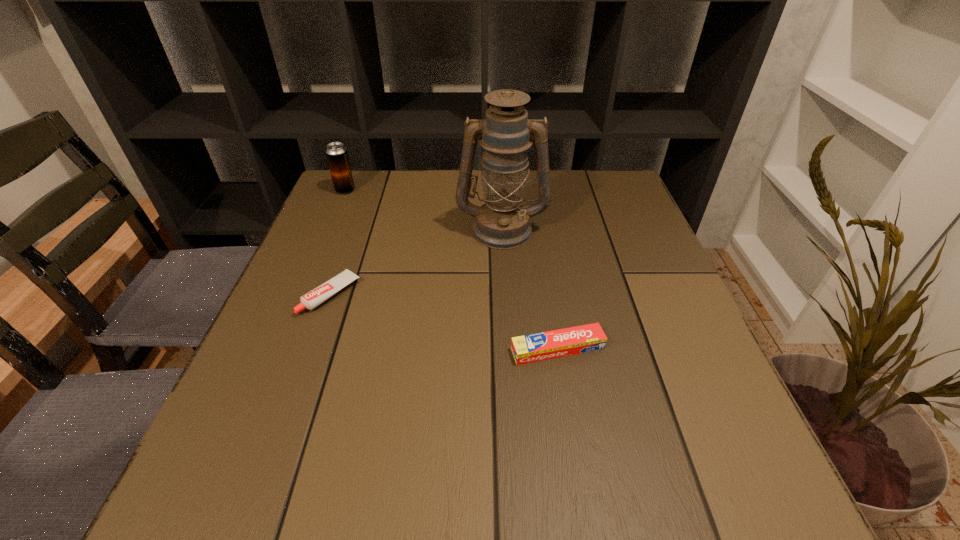
Identify the location of vacant space that is in between the left toothpaste and the oil lamp. The image size is (960, 540). click(x=417, y=262).

Where is `vacant area between the beer can and the tallest object`? vacant area between the beer can and the tallest object is located at coordinates (423, 210).

The image size is (960, 540). What are the coordinates of `free space between the second nearest object and the second tallest object` in the screenshot? It's located at (338, 242).

Choose which object is the third nearest neighbor to the farther toothpaste. Please provide its 2D coordinates. Your answer should be formatted as a tuple, i.e. [(x, y)], where the tuple contains the x and y coordinates of a point satisfying the conditions above.

[(337, 156)]

At what (x,y) coordinates should I click in order to perform the action: click on object that is the third closest one to the farther toothpaste. Please return your answer as a coordinate pair (x, y). This screenshot has width=960, height=540. Looking at the image, I should click on (337, 156).

Locate an element on the screen. free spot that satisfies the following two spatial constraints: 1. on the front side of the beer can; 2. on the right side of the right toothpaste is located at coordinates (276, 349).

Where is `free space that satisfies the following two spatial constraints: 1. on the front side of the nearest object; 2. on the left side of the farther toothpaste`? This screenshot has height=540, width=960. free space that satisfies the following two spatial constraints: 1. on the front side of the nearest object; 2. on the left side of the farther toothpaste is located at coordinates (311, 349).